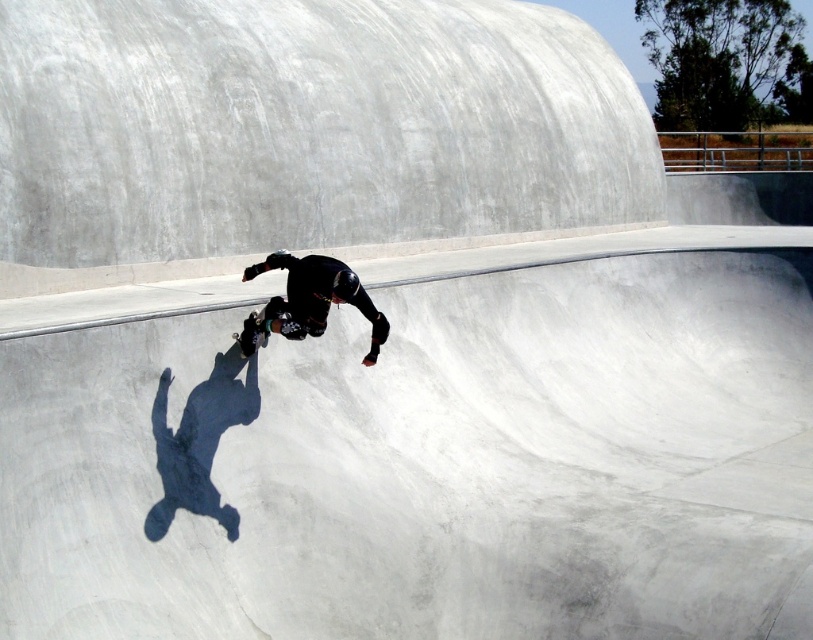
Question: Which point appears farthest from the camera in this image?

Choices:
 (A) (303, 260)
 (B) (261, 324)

Answer: (B)

Question: Can you confirm if black matte skateboarder at center is bigger than black matte skateboard at center?

Choices:
 (A) yes
 (B) no

Answer: (A)

Question: Which point appears farthest from the camera in this image?

Choices:
 (A) (246, 339)
 (B) (246, 321)

Answer: (B)

Question: Among these objects, which one is farthest from the camera?

Choices:
 (A) black matte skateboarder at center
 (B) black matte skateboard at center

Answer: (B)

Question: Can you confirm if black matte skateboarder at center is bigger than black matte skateboard at center?

Choices:
 (A) yes
 (B) no

Answer: (A)

Question: Is black matte skateboarder at center in front of black matte skateboard at center?

Choices:
 (A) yes
 (B) no

Answer: (A)